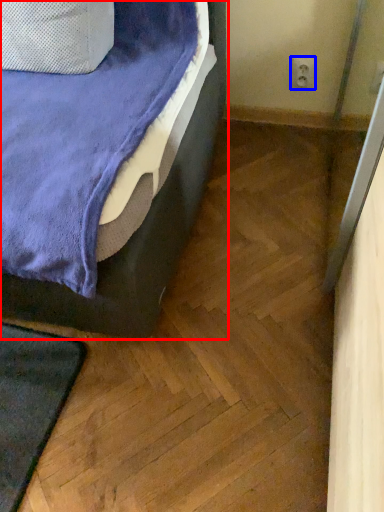
Question: Which of the following is the closest to the observer, bed (highlighted by a red box) or electric outlet (highlighted by a blue box)?

Choices:
 (A) bed
 (B) electric outlet

Answer: (A)